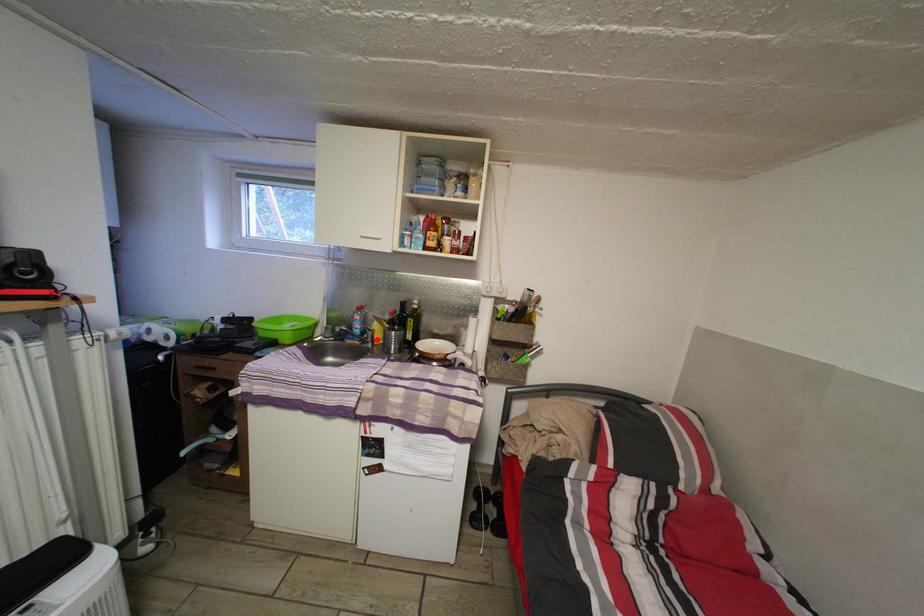
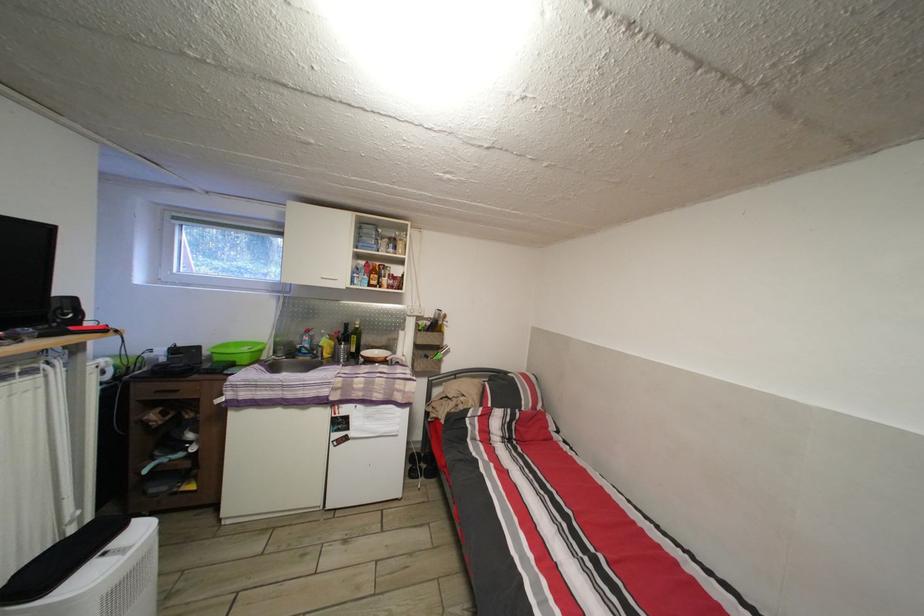
In the second image, find the point that corresponds to the highlighted location in the first image.

(327, 355)